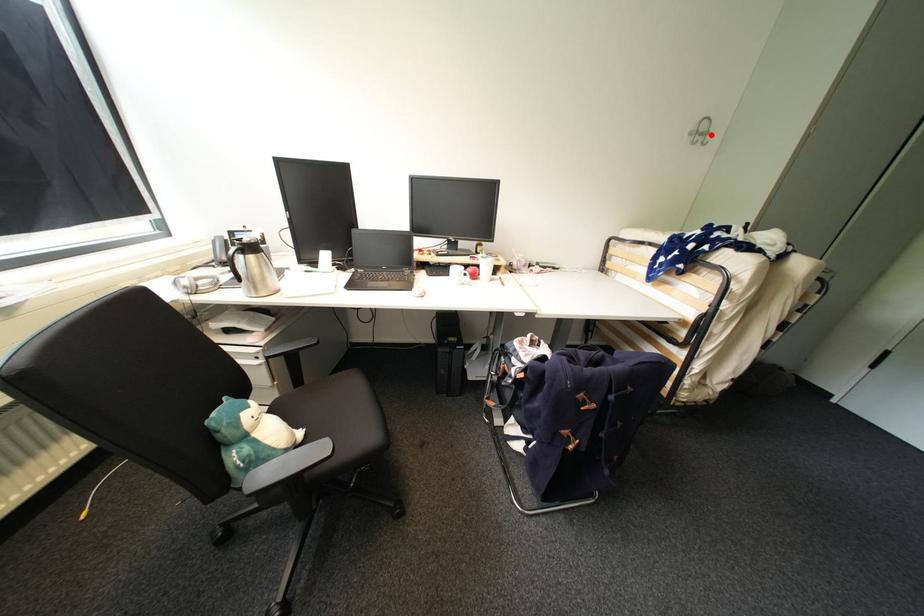
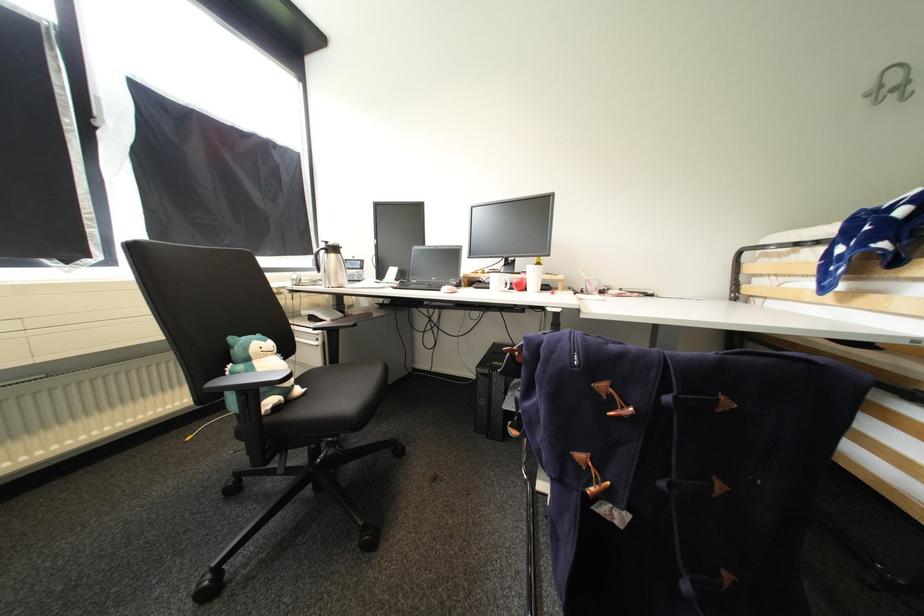
Locate, in the second image, the point that corresponds to the highlighted location in the first image.

(912, 84)